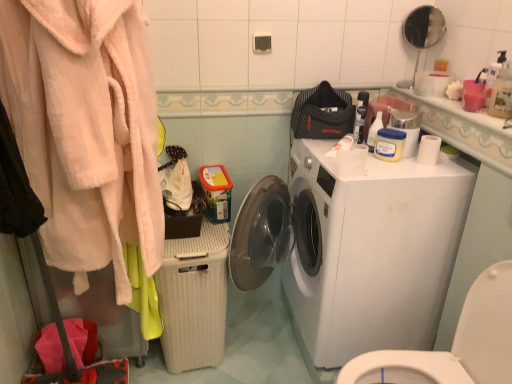
Locate an element on the screen. vacant space in front of translucent plastic spray bottle at upper right, positioned as the 2th cleaning product in front-to-back order is located at coordinates (395, 169).